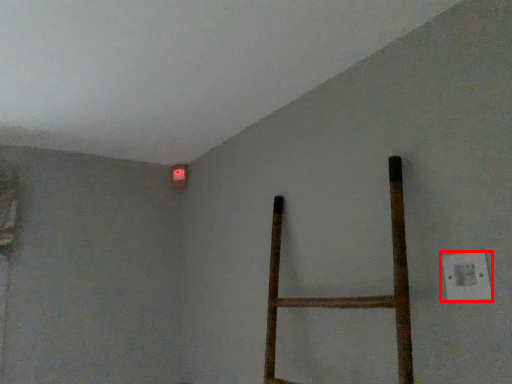
Question: From the image's perspective, where is electric outlet (annotated by the red box) located in relation to lamp in the image?

Choices:
 (A) above
 (B) below

Answer: (B)